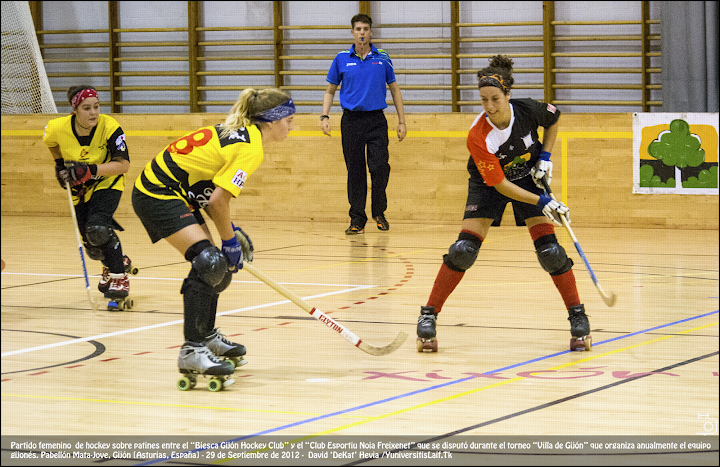
Where is `poster`? The image size is (720, 467). poster is located at coordinates (683, 151).